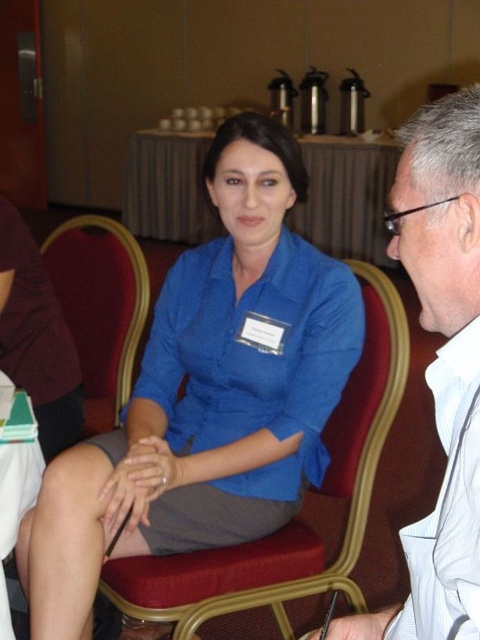
Question: Which point appears farthest from the camera in this image?

Choices:
 (A) (432, 520)
 (B) (100, 483)

Answer: (B)

Question: Can you confirm if blue fabric shirt at center is wider than velvet upholstered chair at center?

Choices:
 (A) yes
 (B) no

Answer: (A)

Question: Is blue fabric shirt at center wider than white glossy shirt at right?

Choices:
 (A) yes
 (B) no

Answer: (A)

Question: Is blue fabric shirt at center smaller than white glossy shirt at right?

Choices:
 (A) no
 (B) yes

Answer: (A)

Question: Which of the following is the farthest from the observer?

Choices:
 (A) (235, 480)
 (B) (122, 380)
 (C) (407, 548)

Answer: (B)

Question: Which point is closer to the camera?

Choices:
 (A) blue fabric shirt at center
 (B) white glossy shirt at right
 (C) velvet upholstered chair at center

Answer: (B)